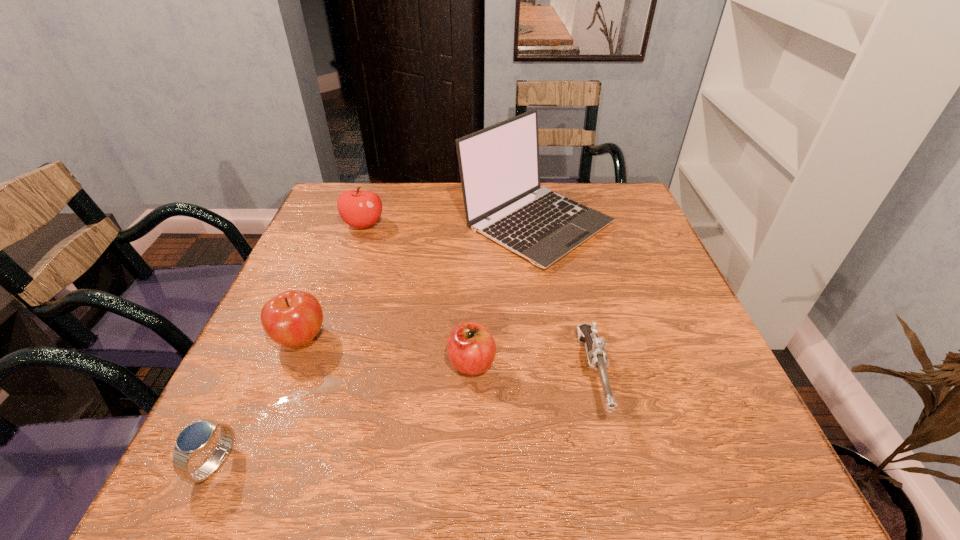
Locate an element on the screen. the tallest object is located at coordinates (499, 167).

Find the location of a particular element. the farthest apple is located at coordinates (360, 209).

Image resolution: width=960 pixels, height=540 pixels. In order to click on the rightmost apple in this screenshot , I will do `click(471, 349)`.

Identify the location of gun. This screenshot has height=540, width=960. (596, 347).

Where is `the nearest object`? This screenshot has height=540, width=960. the nearest object is located at coordinates (196, 437).

Image resolution: width=960 pixels, height=540 pixels. I want to click on free space located 0.400m at the front screen of the laptop_computer, so click(x=570, y=427).

Image resolution: width=960 pixels, height=540 pixels. I want to click on free region located on the right of the farthest apple, so click(473, 224).

What are the coordinates of `vacant space situated 0.110m on the right of the shortest apple` in the screenshot? It's located at [553, 362].

I want to click on free space located 0.070m aimed along the barrel of the gun, so click(614, 468).

This screenshot has width=960, height=540. Identify the location of vacant space positioned on the back of the nearest object. (300, 281).